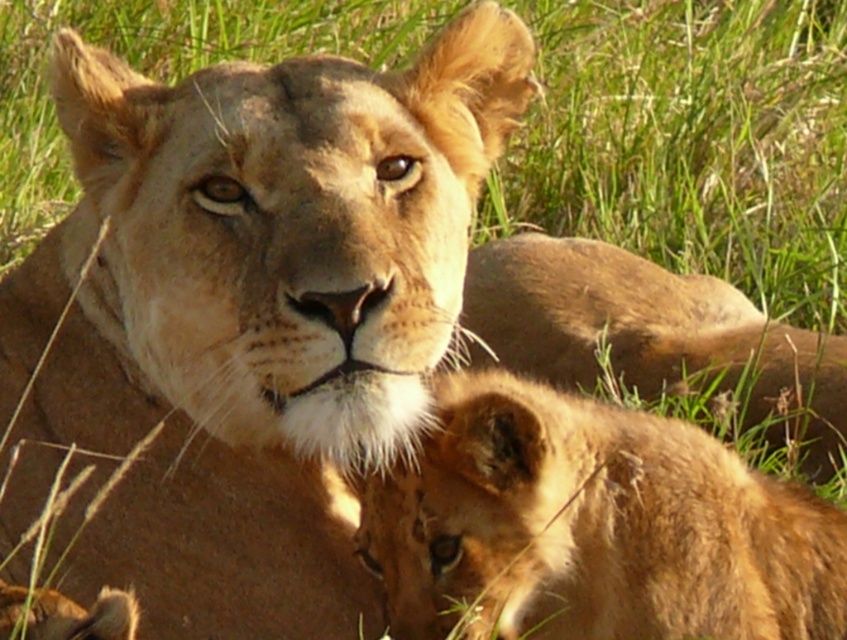
Question: Does golden fur lion at center appear on the right side of golden fur paw at lower left?

Choices:
 (A) yes
 (B) no

Answer: (A)

Question: Does golden fur lion at center have a smaller size compared to golden fur paw at lower left?

Choices:
 (A) yes
 (B) no

Answer: (B)

Question: Which object is the closest to the golden fur cub at lower right?

Choices:
 (A) golden fur lion cub at lower center
 (B) golden fur paw at lower left

Answer: (B)

Question: Considering the relative positions of golden fur cub at lower right and golden fur paw at lower left in the image provided, where is golden fur cub at lower right located with respect to golden fur paw at lower left?

Choices:
 (A) below
 (B) above

Answer: (B)

Question: Which point is farther to the camera?

Choices:
 (A) coord(198,225)
 (B) coord(523,634)
 (C) coord(466,266)

Answer: (C)

Question: Among these objects, which one is farthest from the camera?

Choices:
 (A) golden fur cub at lower right
 (B) golden fur paw at lower left
 (C) golden fur lion at center

Answer: (A)